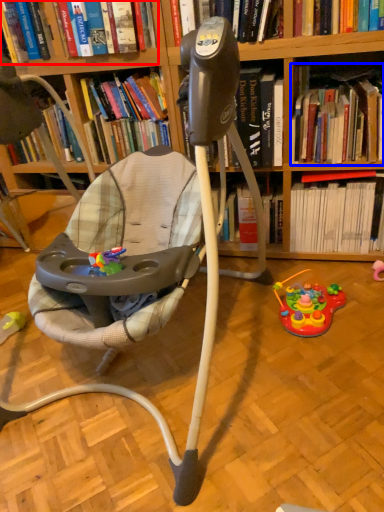
Question: Which object appears farthest to the camera in this image, book (highlighted by a red box) or book (highlighted by a blue box)?

Choices:
 (A) book
 (B) book

Answer: (B)